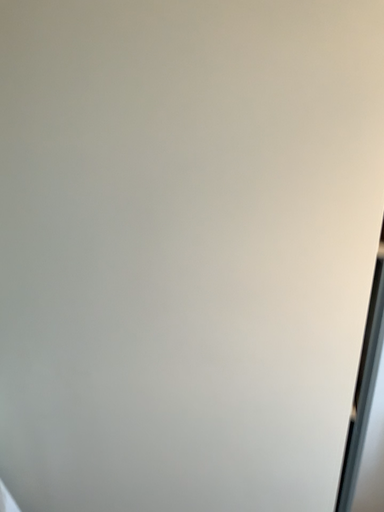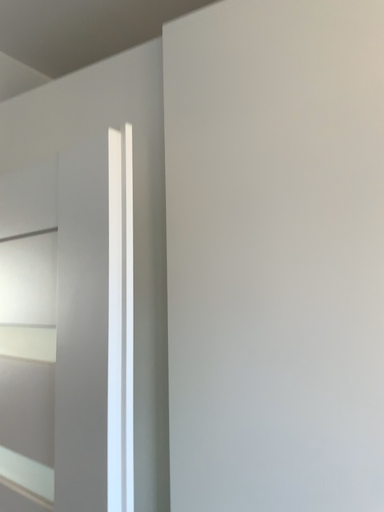
Question: How did the camera likely rotate when shooting the video?

Choices:
 (A) rotated downward
 (B) rotated upward

Answer: (B)